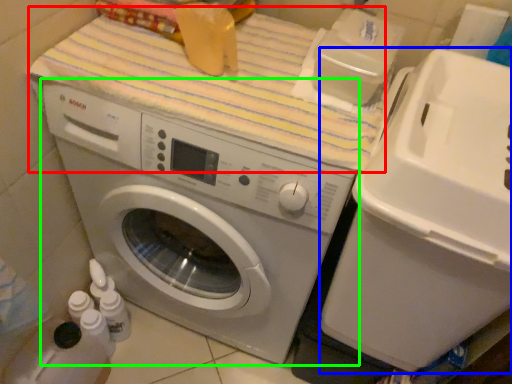
Question: Which object is positioned farthest from bath towel (highlighted by a red box)? Select from water cooler (highlighted by a blue box) and washing machine (highlighted by a green box).

Choices:
 (A) water cooler
 (B) washing machine

Answer: (A)